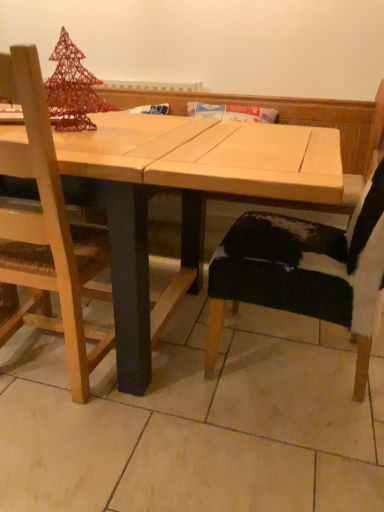
Locate an element on the screen. The height and width of the screenshot is (512, 384). cowhide black chair at lower right, acting as the first chair starting from the right is located at coordinates (291, 301).

Locate an element on the screen. This screenshot has width=384, height=512. wooden chair at left, positioned as the 2th chair in right-to-left order is located at coordinates (48, 233).

Based on the photo, in order to face wooden chair at left, marked as the 1th chair in a left-to-right arrangement, should I rotate leftwards or rightwards?

You should look left and rotate roughly 19.915 degrees.

The image size is (384, 512). I want to click on cowhide black chair at lower right, acting as the first chair starting from the right, so click(x=291, y=301).

From the image's perspective, is natural wood table at center under cowhide black chair at lower right, arranged as the 2th chair when viewed from the left?

Correct, natural wood table at center appears lower than cowhide black chair at lower right, arranged as the 2th chair when viewed from the left, in the image.

Is point (279, 132) closer or farther from the camera than point (226, 280)?

Point (279, 132) is positioned farther from the camera compared to point (226, 280).

From a real-world perspective, relative to cowhide black chair at lower right, arranged as the 2th chair when viewed from the left, is natural wood table at center vertically above or below?

Clearly, from a real-world perspective, natural wood table at center is below cowhide black chair at lower right, arranged as the 2th chair when viewed from the left.

Is natural wood table at center not inside wooden chair at left, marked as the 1th chair in a left-to-right arrangement?

Indeed, natural wood table at center is completely outside wooden chair at left, marked as the 1th chair in a left-to-right arrangement.

Who is shorter, natural wood table at center or wooden chair at left, marked as the 1th chair in a left-to-right arrangement?

natural wood table at center.

Between natural wood table at center and wooden chair at left, positioned as the 2th chair in right-to-left order, which one has smaller size?

Smaller between the two is wooden chair at left, positioned as the 2th chair in right-to-left order.

Considering the relative sizes of natural wood table at center and wooden chair at left, marked as the 1th chair in a left-to-right arrangement, in the image provided, is natural wood table at center wider than wooden chair at left, marked as the 1th chair in a left-to-right arrangement,?

Yes.

Could natural wood table at center be considered to be inside wooden chair at left, positioned as the 2th chair in right-to-left order?

No, wooden chair at left, positioned as the 2th chair in right-to-left order, does not contain natural wood table at center.

Is wooden chair at left, marked as the 1th chair in a left-to-right arrangement, thinner than natural wood table at center?

Yes.

Is cowhide black chair at lower right, acting as the first chair starting from the right, to the left of natural wood table at center from the viewer's perspective?

In fact, cowhide black chair at lower right, acting as the first chair starting from the right, is to the right of natural wood table at center.

Is cowhide black chair at lower right, arranged as the 2th chair when viewed from the left, situated inside natural wood table at center or outside?

cowhide black chair at lower right, arranged as the 2th chair when viewed from the left, can be found inside natural wood table at center.

I want to click on table behind the cowhide black chair at lower right, acting as the first chair starting from the right, so click(186, 195).

Measure the distance between cowhide black chair at lower right, acting as the first chair starting from the right, and natural wood table at center.

A distance of 15.24 inches exists between cowhide black chair at lower right, acting as the first chair starting from the right, and natural wood table at center.

I want to click on chair below the cowhide black chair at lower right, acting as the first chair starting from the right (from a real-world perspective), so click(x=48, y=233).

Consider the image. Is wooden chair at left, marked as the 1th chair in a left-to-right arrangement, bigger than cowhide black chair at lower right, arranged as the 2th chair when viewed from the left?

Incorrect, wooden chair at left, marked as the 1th chair in a left-to-right arrangement, is not larger than cowhide black chair at lower right, arranged as the 2th chair when viewed from the left.

Is wooden chair at left, positioned as the 2th chair in right-to-left order, inside the boundaries of cowhide black chair at lower right, arranged as the 2th chair when viewed from the left, or outside?

wooden chair at left, positioned as the 2th chair in right-to-left order, is not inside cowhide black chair at lower right, arranged as the 2th chair when viewed from the left, it's outside.

Which is nearer, [241,287] or [46,234]?

The point [46,234] is closer.

Which of these two, cowhide black chair at lower right, acting as the first chair starting from the right, or wooden chair at left, marked as the 1th chair in a left-to-right arrangement, is wider?

Wider between the two is cowhide black chair at lower right, acting as the first chair starting from the right.

Considering the positions of objects cowhide black chair at lower right, acting as the first chair starting from the right, and wooden chair at left, marked as the 1th chair in a left-to-right arrangement, in the image provided, who is behind, cowhide black chair at lower right, acting as the first chair starting from the right, or wooden chair at left, marked as the 1th chair in a left-to-right arrangement,?

wooden chair at left, marked as the 1th chair in a left-to-right arrangement.

Find the location of a particular element. chair above the natural wood table at center (from the image's perspective) is located at coordinates (291, 301).

Starting from the natural wood table at center, which chair is the 1st one in front? Please provide its 2D coordinates.

[(48, 233)]

From the image, which object appears to be farther from natural wood table at center, cowhide black chair at lower right, arranged as the 2th chair when viewed from the left, or wooden chair at left, positioned as the 2th chair in right-to-left order?

Based on the image, cowhide black chair at lower right, arranged as the 2th chair when viewed from the left, appears to be further to natural wood table at center.

From the image, which object appears to be nearer to natural wood table at center, wooden chair at left, positioned as the 2th chair in right-to-left order, or cowhide black chair at lower right, arranged as the 2th chair when viewed from the left?

wooden chair at left, positioned as the 2th chair in right-to-left order, is positioned closer to the anchor natural wood table at center.

From the image, which object appears to be farther from wooden chair at left, positioned as the 2th chair in right-to-left order, natural wood table at center or cowhide black chair at lower right, acting as the first chair starting from the right?

cowhide black chair at lower right, acting as the first chair starting from the right, is further to wooden chair at left, positioned as the 2th chair in right-to-left order.

Estimate the real-world distances between objects in this image. Which object is closer to cowhide black chair at lower right, acting as the first chair starting from the right, wooden chair at left, marked as the 1th chair in a left-to-right arrangement, or natural wood table at center?

Among the two, natural wood table at center is located nearer to cowhide black chair at lower right, acting as the first chair starting from the right.

Looking at the image, which one is located closer to cowhide black chair at lower right, arranged as the 2th chair when viewed from the left, natural wood table at center or wooden chair at left, positioned as the 2th chair in right-to-left order?

natural wood table at center.

Based on their spatial positions, is cowhide black chair at lower right, arranged as the 2th chair when viewed from the left, or natural wood table at center further from wooden chair at left, positioned as the 2th chair in right-to-left order?

Among the two, cowhide black chair at lower right, arranged as the 2th chair when viewed from the left, is located further to wooden chair at left, positioned as the 2th chair in right-to-left order.

Locate an element on the screen. Image resolution: width=384 pixels, height=512 pixels. table between wooden chair at left, marked as the 1th chair in a left-to-right arrangement, and cowhide black chair at lower right, acting as the first chair starting from the right, from left to right is located at coordinates (186, 195).